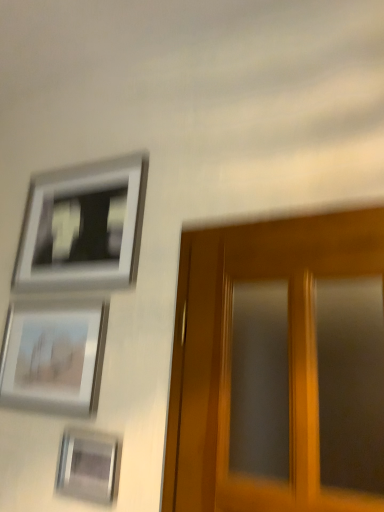
Question: From a real-world perspective, is matte silver picture frame at lower left, the 2th picture frame when ordered from top to bottom, located beneath metallic silver picture frame at lower left, the 1th picture frame ordered from the bottom?

Choices:
 (A) yes
 (B) no

Answer: (B)

Question: From the image's perspective, is matte silver picture frame at lower left, the 2th picture frame when ordered from top to bottom, located beneath metallic silver picture frame at lower left, positioned as the third picture frame in top-to-bottom order?

Choices:
 (A) no
 (B) yes

Answer: (A)

Question: Would you say matte silver picture frame at lower left, the 2th picture frame when ordered from top to bottom, is a long distance from metallic silver picture frame at lower left, positioned as the third picture frame in top-to-bottom order?

Choices:
 (A) yes
 (B) no

Answer: (B)

Question: Considering the relative sizes of matte silver picture frame at lower left, the 2th picture frame when ordered from bottom to top, and metallic silver picture frame at lower left, the 1th picture frame ordered from the bottom, in the image provided, is matte silver picture frame at lower left, the 2th picture frame when ordered from bottom to top, bigger than metallic silver picture frame at lower left, the 1th picture frame ordered from the bottom,?

Choices:
 (A) yes
 (B) no

Answer: (A)

Question: From the image's perspective, is matte silver picture frame at lower left, the 2th picture frame when ordered from bottom to top, over metallic silver picture frame at lower left, the 1th picture frame ordered from the bottom?

Choices:
 (A) yes
 (B) no

Answer: (A)

Question: Is matte silver picture frame at lower left, the 2th picture frame when ordered from top to bottom, facing towards metallic silver picture frame at lower left, positioned as the third picture frame in top-to-bottom order?

Choices:
 (A) yes
 (B) no

Answer: (B)

Question: From the image's perspective, would you say silver metallic picture frame at upper left, which is the third picture frame from bottom to top, is positioned over matte silver picture frame at lower left, the 2th picture frame when ordered from top to bottom?

Choices:
 (A) no
 (B) yes

Answer: (B)

Question: Is silver metallic picture frame at upper left, which is the third picture frame from bottom to top, at the left side of matte silver picture frame at lower left, the 2th picture frame when ordered from bottom to top?

Choices:
 (A) yes
 (B) no

Answer: (B)

Question: Does silver metallic picture frame at upper left, which is the first picture frame from top to bottom, have a lesser height compared to matte silver picture frame at lower left, the 2th picture frame when ordered from top to bottom?

Choices:
 (A) no
 (B) yes

Answer: (A)

Question: Is silver metallic picture frame at upper left, which is the third picture frame from bottom to top, positioned behind matte silver picture frame at lower left, the 2th picture frame when ordered from top to bottom?

Choices:
 (A) yes
 (B) no

Answer: (A)

Question: Can you confirm if silver metallic picture frame at upper left, which is the third picture frame from bottom to top, is thinner than matte silver picture frame at lower left, the 2th picture frame when ordered from bottom to top?

Choices:
 (A) no
 (B) yes

Answer: (A)

Question: From a real-world perspective, is silver metallic picture frame at upper left, which is the first picture frame from top to bottom, located higher than matte silver picture frame at lower left, the 2th picture frame when ordered from top to bottom?

Choices:
 (A) no
 (B) yes

Answer: (B)

Question: From a real-world perspective, is silver metallic picture frame at upper left, which is the third picture frame from bottom to top, on metallic silver picture frame at lower left, the 1th picture frame ordered from the bottom?

Choices:
 (A) no
 (B) yes

Answer: (B)